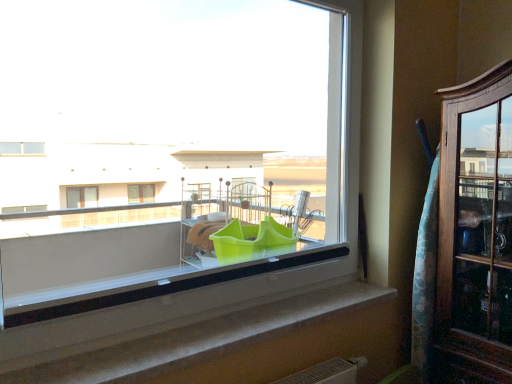
Question: Is smooth concrete window sill at center bigger or smaller than wooden cabinet at right?

Choices:
 (A) big
 (B) small

Answer: (B)

Question: From the image's perspective, is smooth concrete window sill at center positioned above or below wooden cabinet at right?

Choices:
 (A) above
 (B) below

Answer: (B)

Question: Which object is the closest to the green plastic container at center?

Choices:
 (A) smooth concrete window sill at center
 (B) wooden cabinet at right

Answer: (B)

Question: Which of these objects is positioned closest to the green plastic container at center?

Choices:
 (A) wooden cabinet at right
 (B) smooth concrete window sill at center

Answer: (A)